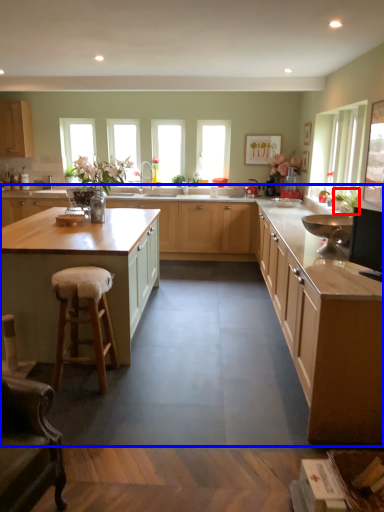
Question: Which of the following is the closest to the observer, plant (highlighted by a red box) or cabinetry (highlighted by a blue box)?

Choices:
 (A) plant
 (B) cabinetry

Answer: (B)